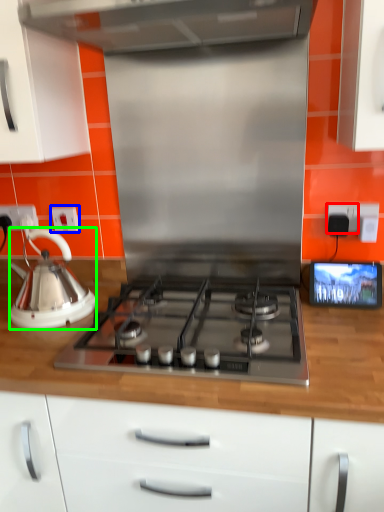
Question: Which is farther away from electric outlet (highlighted by a red box)? electric outlet (highlighted by a blue box) or kettle (highlighted by a green box)?

Choices:
 (A) electric outlet
 (B) kettle

Answer: (B)